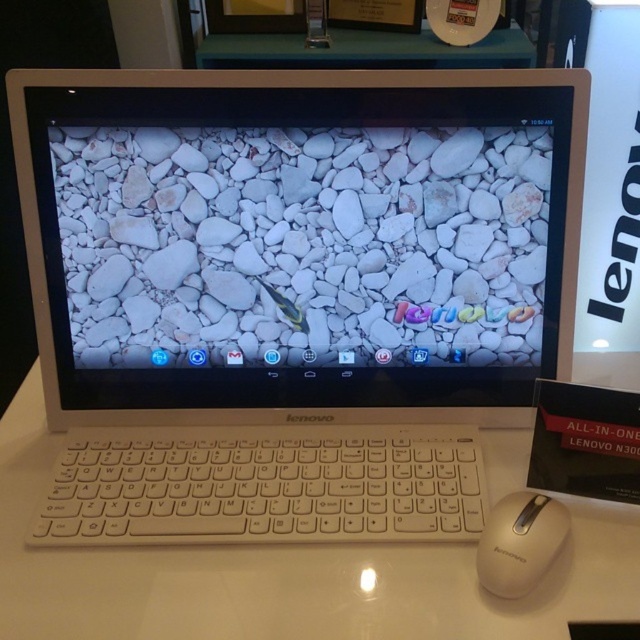
Question: Which of the following is the farthest from the observer?

Choices:
 (A) white plastic keyboard at center
 (B) white matte laptop at center

Answer: (B)

Question: Which point is closer to the camera?

Choices:
 (A) (484, 573)
 (B) (420, 88)
 (C) (356, 554)

Answer: (A)

Question: Which point appears closest to the camera in this image?

Choices:
 (A) (232, 419)
 (B) (289, 412)
 (C) (392, 474)
 (D) (545, 504)

Answer: (D)

Question: Is white matte laptop at center closer to camera compared to white matte mouse at lower right?

Choices:
 (A) no
 (B) yes

Answer: (A)

Question: Can you confirm if white plastic keyboard at center is positioned to the right of white matte mouse at lower right?

Choices:
 (A) no
 (B) yes

Answer: (A)

Question: Is white matte laptop at center thinner than white plastic keyboard at center?

Choices:
 (A) yes
 (B) no

Answer: (B)